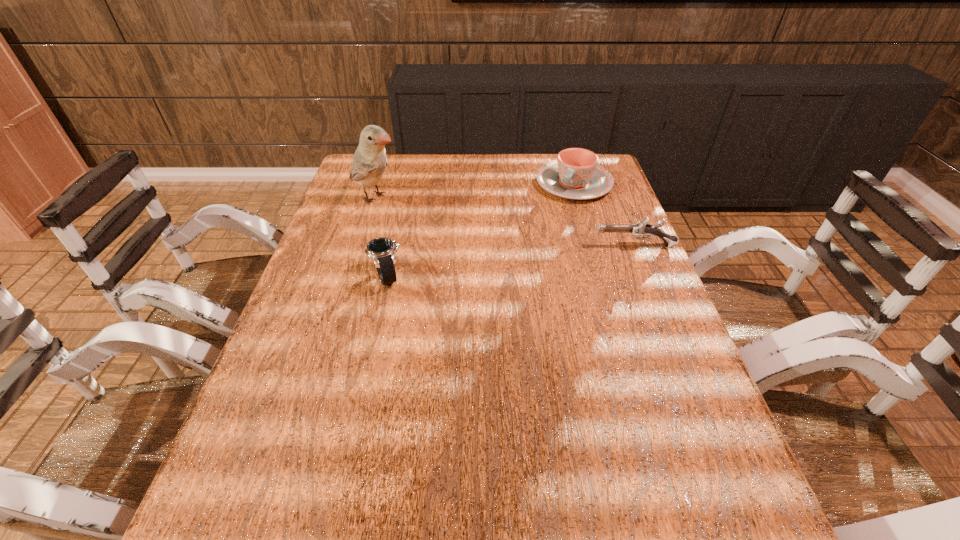
Locate an element on the screen. object that is at the far right corner is located at coordinates (576, 175).

The image size is (960, 540). Identify the location of blank space at the far edge of the desktop. (452, 171).

You are a GUI agent. You are given a task and a screenshot of the screen. Output one action in this format:
    pyautogui.click(x=<x>, y=<y>)
    Task: Click on the vacant space at the near edge
    
    Given the screenshot: What is the action you would take?
    pyautogui.click(x=352, y=464)

At what (x,y) coordinates should I click in order to perform the action: click on vacant space at the left edge. Please return your answer as a coordinate pair (x, y). The width and height of the screenshot is (960, 540). Looking at the image, I should click on coord(328,232).

Find the location of a particular element. This screenshot has height=540, width=960. free spot at the right edge of the desktop is located at coordinates (672, 319).

The width and height of the screenshot is (960, 540). Find the location of `free space at the near left corner of the desktop`. free space at the near left corner of the desktop is located at coordinates click(x=315, y=466).

Locate an element on the screen. free area in between the second nearest object and the tallest object is located at coordinates (505, 222).

The height and width of the screenshot is (540, 960). I want to click on empty space that is in between the bird and the chinaware, so click(474, 191).

Identify the location of unoccupied position between the chinaware and the bird. (x=474, y=191).

Locate an element on the screen. The height and width of the screenshot is (540, 960). free space between the gun and the chinaware is located at coordinates (604, 215).